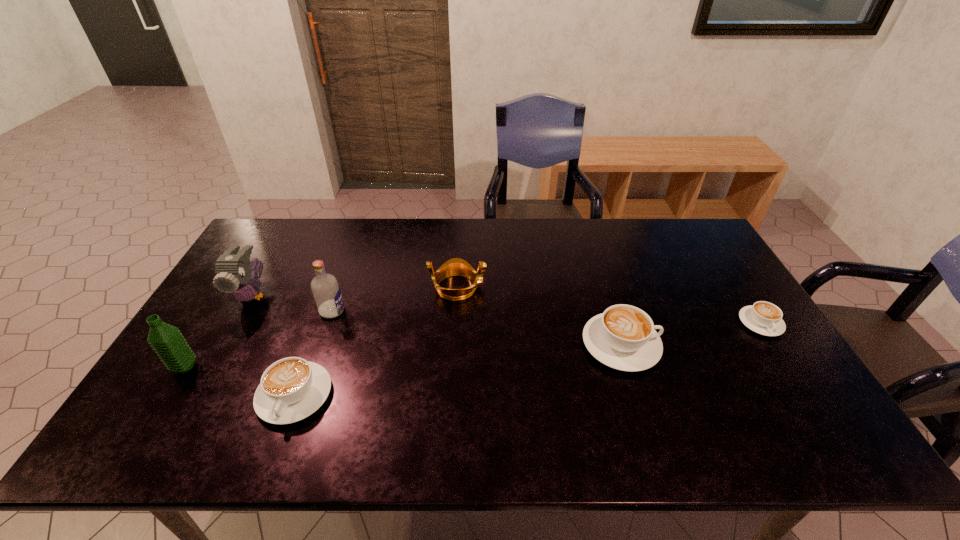
To ensure equal spacing by inserting another cappuccino among them, please point out a vacant spot for this new cappuccino. Please provide its 2D coordinates. Your answer should be formatted as a tuple, i.e. [(x, y)], where the tuple contains the x and y coordinates of a point satisfying the conditions above.

[(467, 368)]